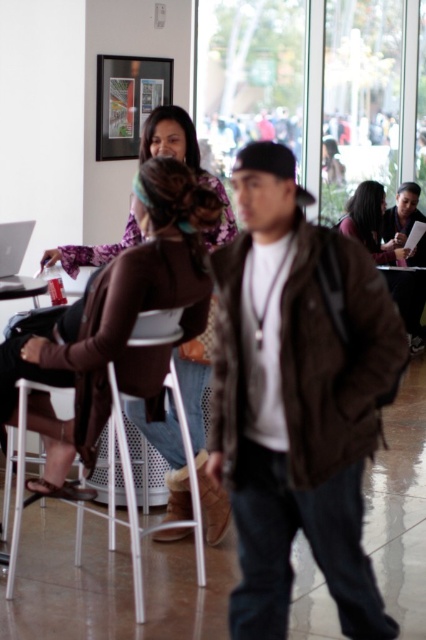
You are standing at the entrance of the space and want to locate the matte brown jacket at center. Based on the coordinate system where the bottom left corner is the origin, can you determine its position?

The matte brown jacket at center is located at the 2D coordinates point (x=371, y=224).

You are a photographer trying to capture a candid shot of both the brown leather jacket at center and the matte brown jacket at center. Since you want them to appear side by side in the photo, which jacket should you position to the left in your camera frame?

The brown leather jacket at center is positioned on the left side of matte brown jacket at center, so you should place the brown leather jacket at center to the left in your camera frame to match their actual positions.